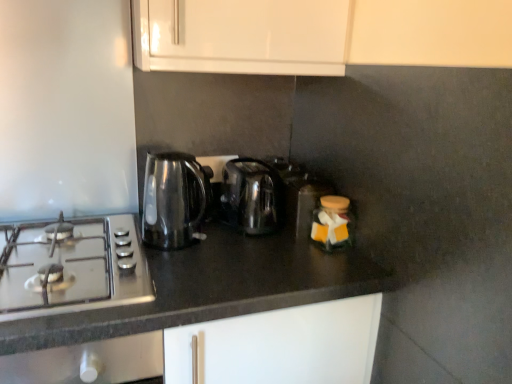
Find the location of a particular element. Image resolution: width=512 pixels, height=384 pixels. empty space that is ontop of black granite countertop at center (from a real-world perspective) is located at coordinates (152, 258).